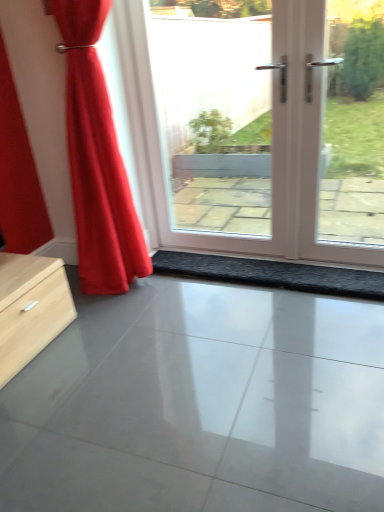
Question: Is white glossy door at center situated inside satin red curtain at left or outside?

Choices:
 (A) inside
 (B) outside

Answer: (B)

Question: Relative to satin red curtain at left, is white glossy door at center in front or behind?

Choices:
 (A) front
 (B) behind

Answer: (B)

Question: Which object is positioned farthest from the white glossy door at center?

Choices:
 (A) black textured mat at center
 (B) satin red curtain at left
 (C) glossy concrete floor at center

Answer: (C)

Question: Estimate the real-world distances between objects in this image. Which object is closer to the glossy concrete floor at center?

Choices:
 (A) satin red curtain at left
 (B) black textured mat at center
 (C) white glossy door at center

Answer: (B)